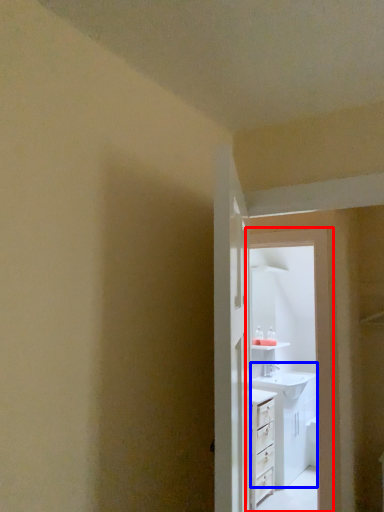
Question: Which point is further to the camera, screen door (highlighted by a red box) or sink (highlighted by a blue box)?

Choices:
 (A) screen door
 (B) sink

Answer: (B)